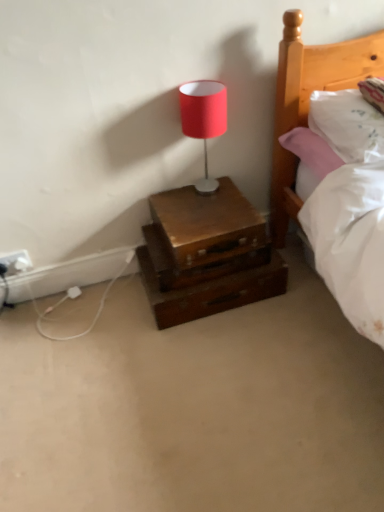
Image resolution: width=384 pixels, height=512 pixels. Identify the location of empty space that is ontop of wooden chest at lower center (from a real-world perspective). (197, 209).